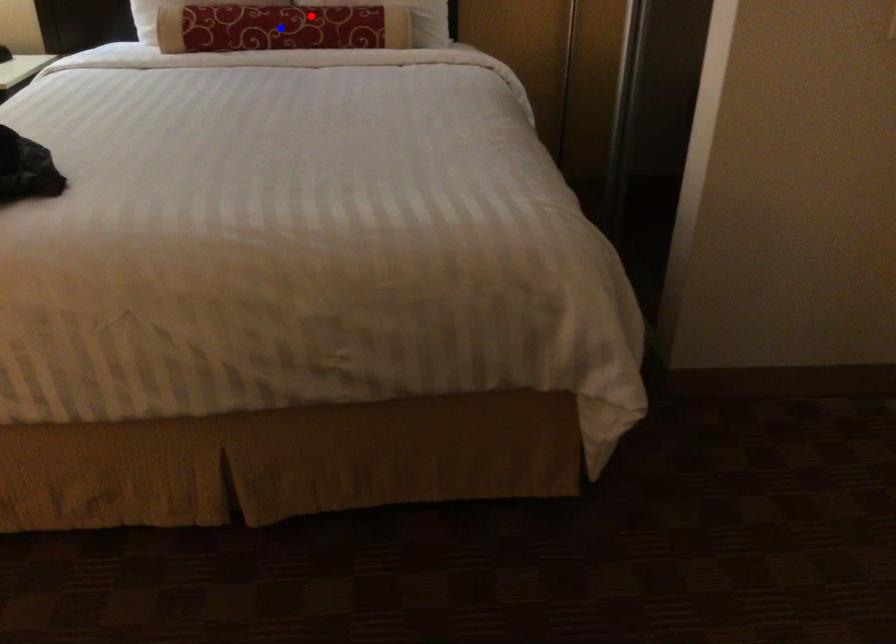
Question: Two points are marked on the image. Which point is closer to the camera?

Choices:
 (A) Blue point is closer.
 (B) Red point is closer.

Answer: (A)